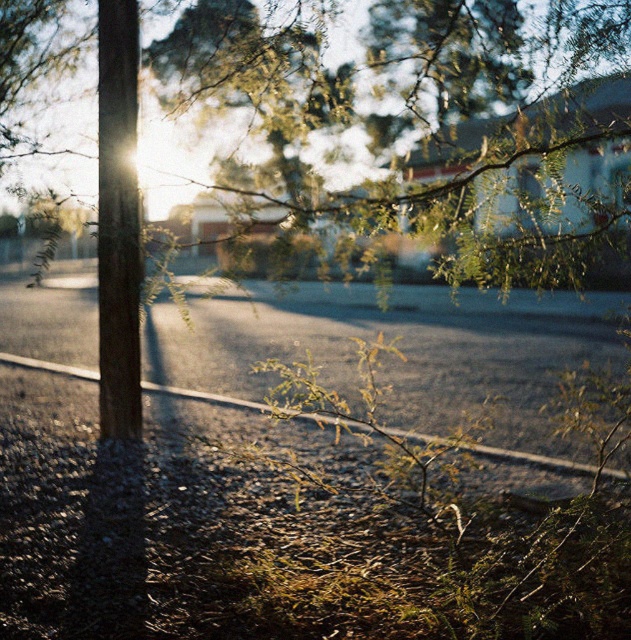
Does green leafy branch at center have a smaller size compared to wooden pole at left?

Incorrect, green leafy branch at center is not smaller in size than wooden pole at left.

Consider the image. Which of these two, green leafy branch at center or wooden pole at left, stands shorter?

Standing shorter between the two is wooden pole at left.

At what (x,y) coordinates should I click in order to perform the action: click on green leafy branch at center. Please return your answer as a coordinate pair (x, y). Image resolution: width=631 pixels, height=640 pixels. Looking at the image, I should click on (411, 115).

You are a GUI agent. You are given a task and a screenshot of the screen. Output one action in this format:
    pyautogui.click(x=<x>, y=<y>)
    Task: Click on the green leafy branch at center
    
    Given the screenshot: What is the action you would take?
    pyautogui.click(x=411, y=115)